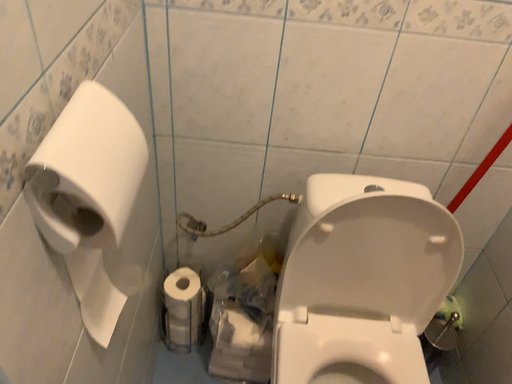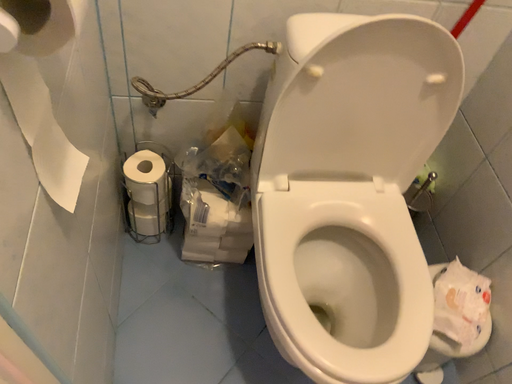
Question: How did the camera likely rotate when shooting the video?

Choices:
 (A) rotated right
 (B) rotated left

Answer: (A)